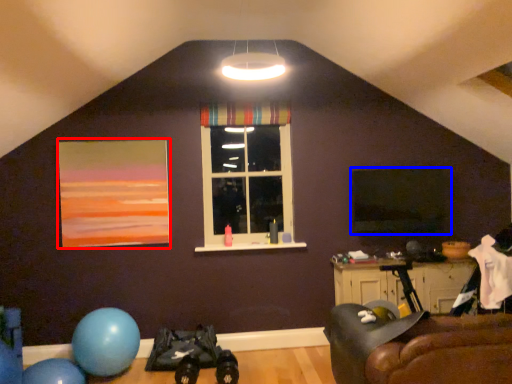
Question: Which object appears farthest to the camera in this image, picture frame (highlighted by a red box) or window screen (highlighted by a blue box)?

Choices:
 (A) picture frame
 (B) window screen

Answer: (B)